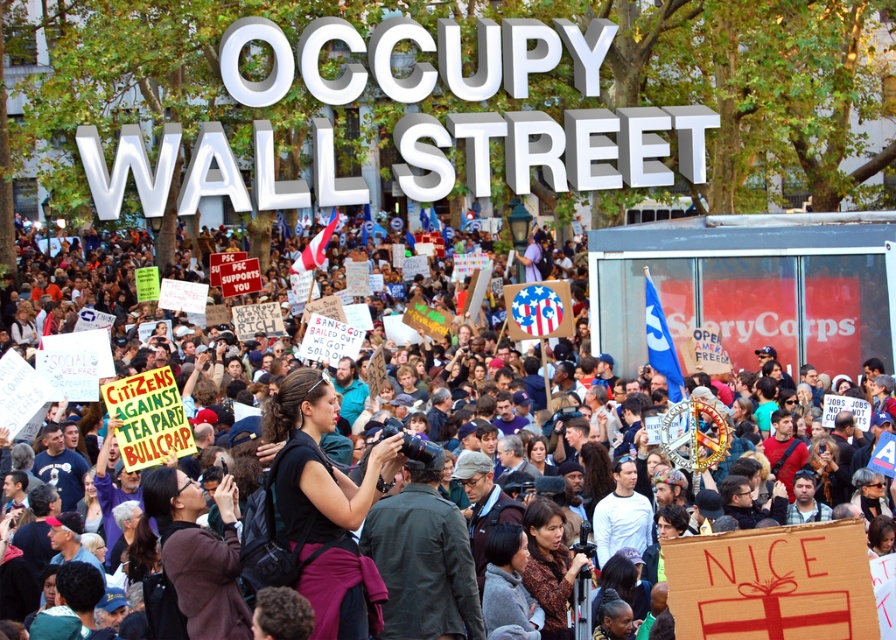
In the middle of the protest scene, there are white cardboard signs at center and a brown leather jacket at center. Which object is positioned to the left?

The white cardboard signs at center are to the left of the brown leather jacket at center.

You are a photographer trying to capture the protest scene. You notice the white cardboard signs at center and the brown patterned dress at lower center. Which object would appear bigger in your photo?

The white cardboard signs at center would appear bigger in the photo since they are larger in size than the brown patterned dress at lower center.

In the OCCUPY WALL STREET protest scene, there are two people wearing a brown leather jacket at center and a brown patterned dress at lower center. From the perspective of someone standing at the front of the protest, which clothing item is positioned to the left?

The brown leather jacket at center is to the left of the brown patterned dress at lower center.